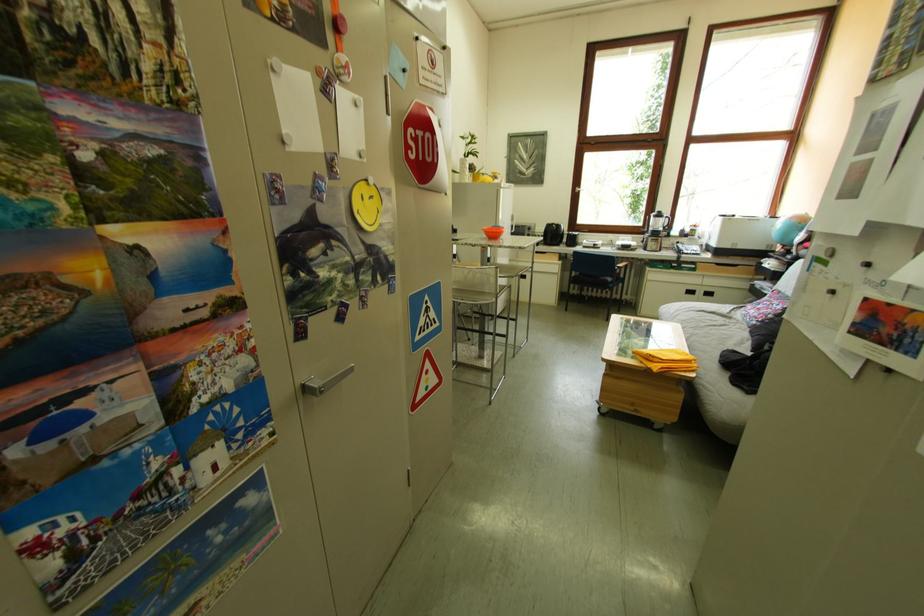
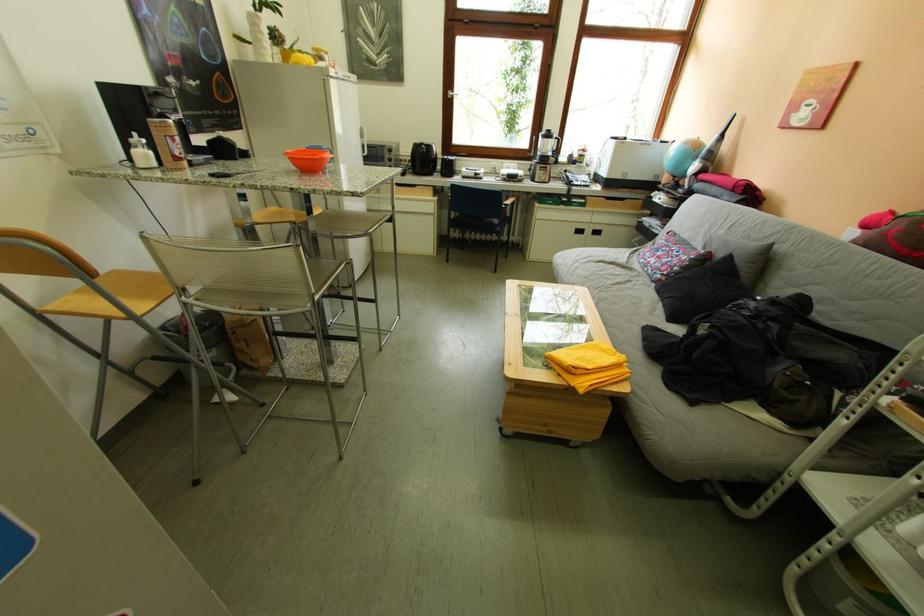
What movement of the cameraman would produce the second image?

The cameraman walked toward right, forward.